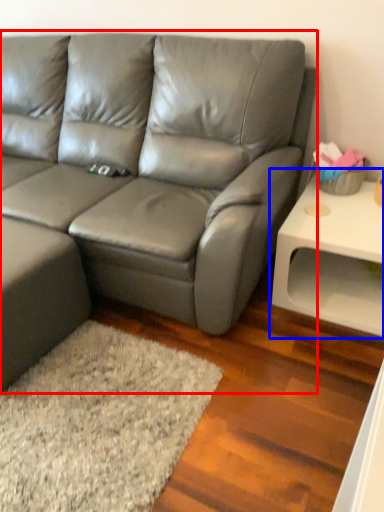
Question: Which point is closer to the camera, studio couch (highlighted by a red box) or table (highlighted by a blue box)?

Choices:
 (A) studio couch
 (B) table

Answer: (A)